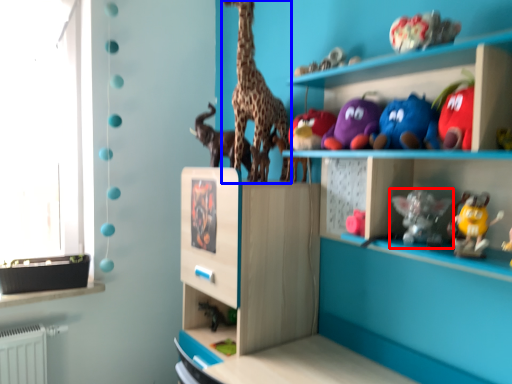
Question: Which object appears closest to the camera in this image, toy (highlighted by a red box) or giraffe (highlighted by a blue box)?

Choices:
 (A) toy
 (B) giraffe

Answer: (A)